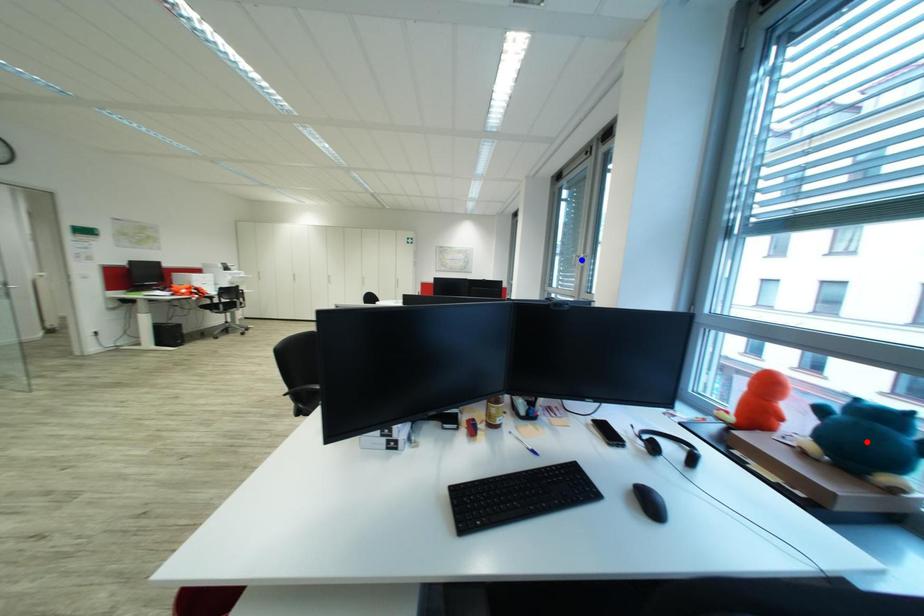
Question: In the image, two points are highlighted. Which point is nearer to the camera? Reply with the corresponding letter.

Choices:
 (A) blue point
 (B) red point

Answer: (B)